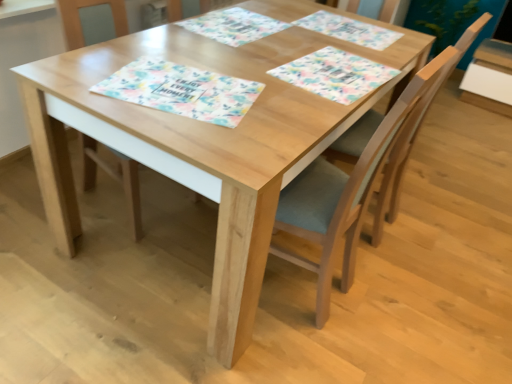
Locate an element on the screen. The width and height of the screenshot is (512, 384). vacant space underneath floral paper placemat at upper center, which is counted as the 4th place mat, starting from the front (from a real-world perspective) is located at coordinates (x=357, y=29).